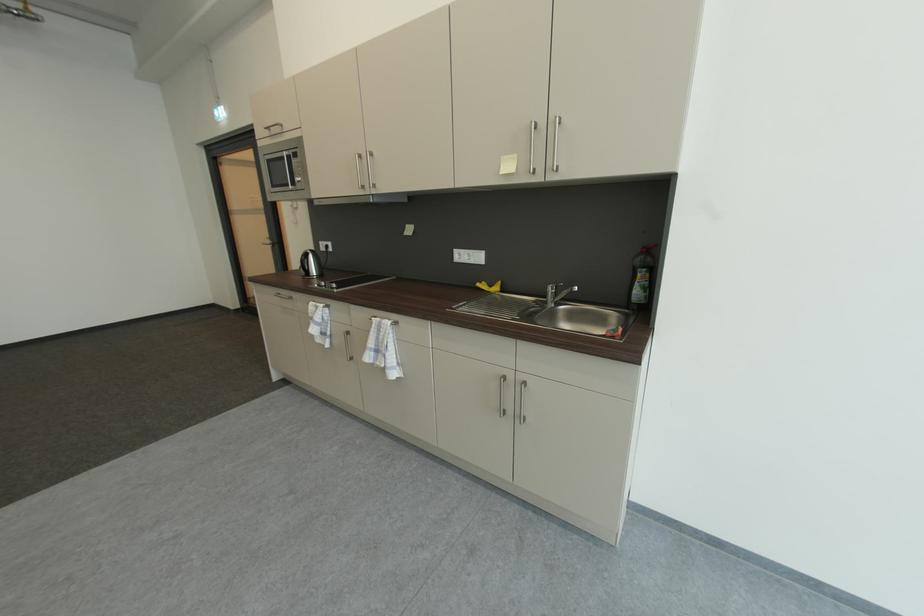
You are a GUI agent. You are given a task and a screenshot of the screen. Output one action in this format:
    pyautogui.click(x=<x>, y=<y>)
    Task: Click on the green soap bottle
    Image resolution: width=924 pixels, height=616 pixels.
    Given the screenshot: What is the action you would take?
    pyautogui.click(x=640, y=277)